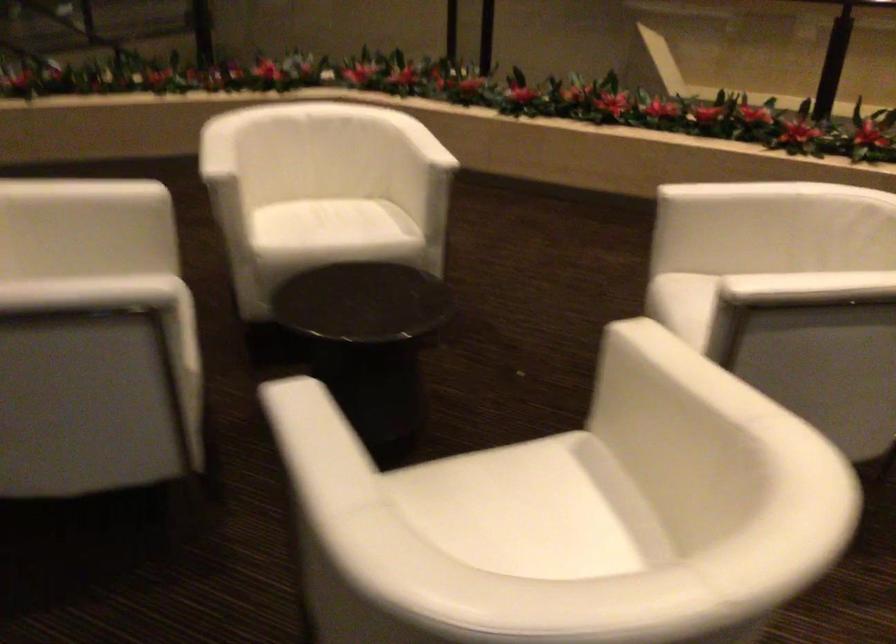
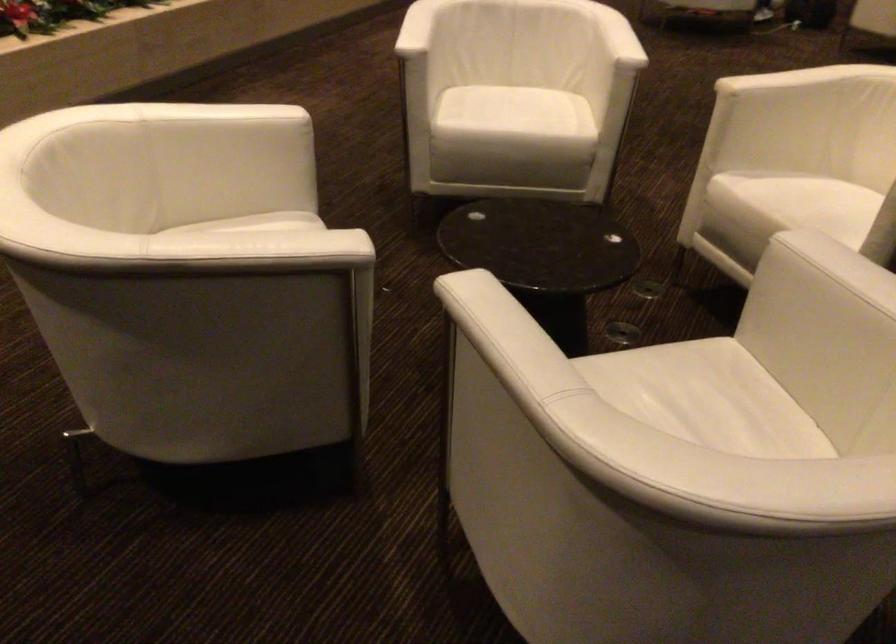
Where in the second image is the point corresponding to point (721, 187) from the first image?

(417, 28)